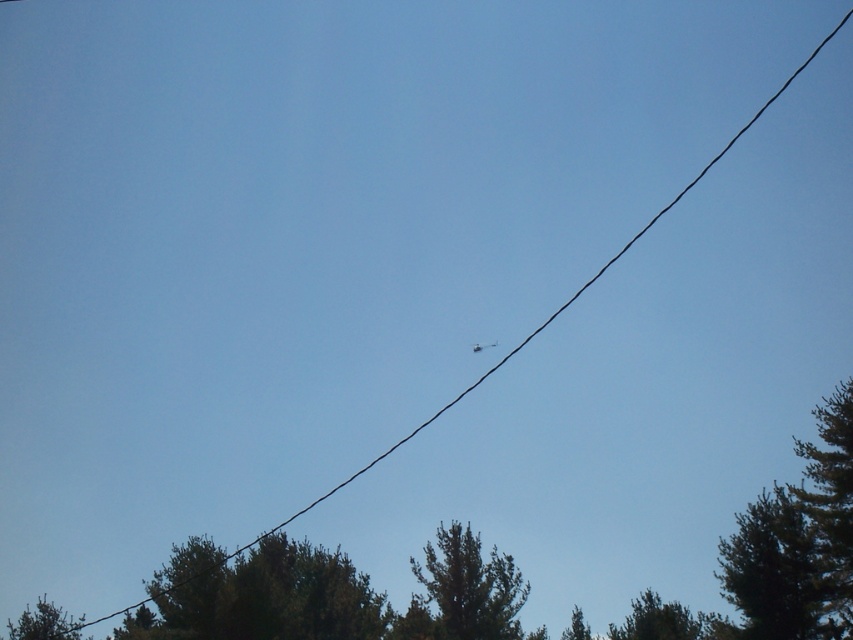
Is green leafy tree at upper center to the left of green leafy tree at upper right from the viewer's perspective?

Yes, green leafy tree at upper center is to the left of green leafy tree at upper right.

Who is more distant from viewer, (x=463, y=563) or (x=833, y=572)?

The point (x=463, y=563) is behind.

Between point (438, 588) and point (834, 500), which one is positioned behind?

The point (438, 588) is more distant.

Identify the location of green leafy tree at upper center. This screenshot has height=640, width=853. (463, 592).

Does green textured tree at upper right have a lesser height compared to green leafy tree at upper center?

Correct, green textured tree at upper right is not as tall as green leafy tree at upper center.

Which is below, green textured tree at upper right or green leafy tree at upper center?

green leafy tree at upper center is lower down.

Who is more forward, (798, 556) or (468, 632)?

Positioned in front is point (798, 556).

At what (x,y) coordinates should I click in order to perform the action: click on green textured tree at upper right. Please return your answer as a coordinate pair (x, y). Image resolution: width=853 pixels, height=640 pixels. Looking at the image, I should click on (776, 572).

Which is above, green leafy tree at lower left or green leafy tree at lower right?

green leafy tree at lower left is above.

Does green leafy tree at lower left have a greater height compared to green leafy tree at lower right?

No.

Locate an element on the screen. green leafy tree at lower left is located at coordinates (260, 595).